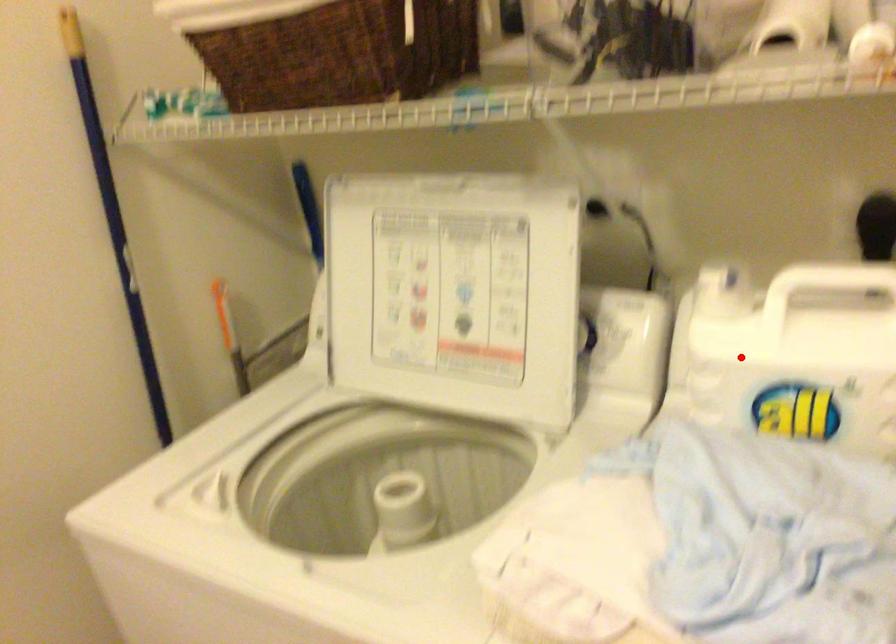
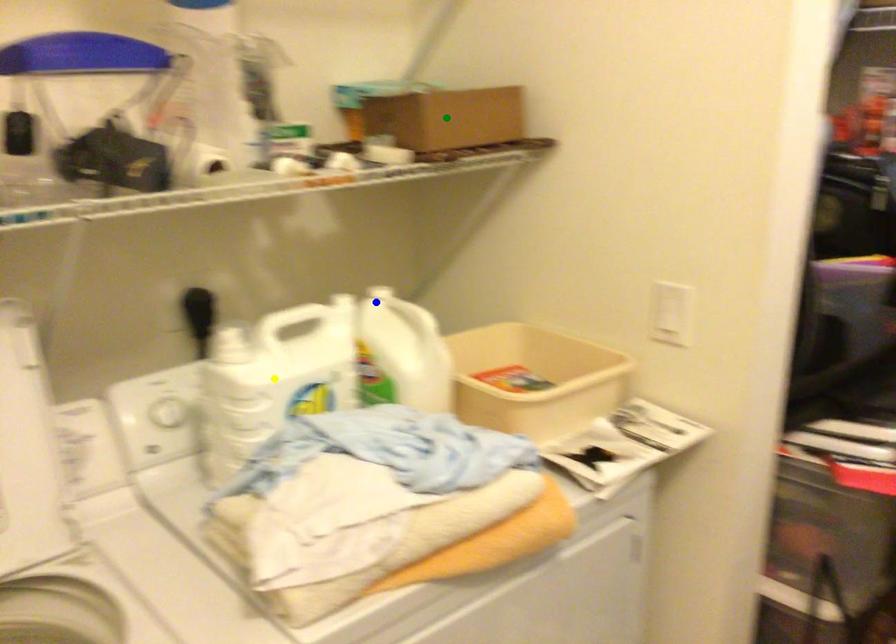
Question: I am providing you with two images of the same scene from different viewpoints. A red point is marked on the first image. You are given multiple points on the second image. Which spot in image 2 lines up with the point in image 1?

Choices:
 (A) blue point
 (B) yellow point
 (C) green point

Answer: (B)